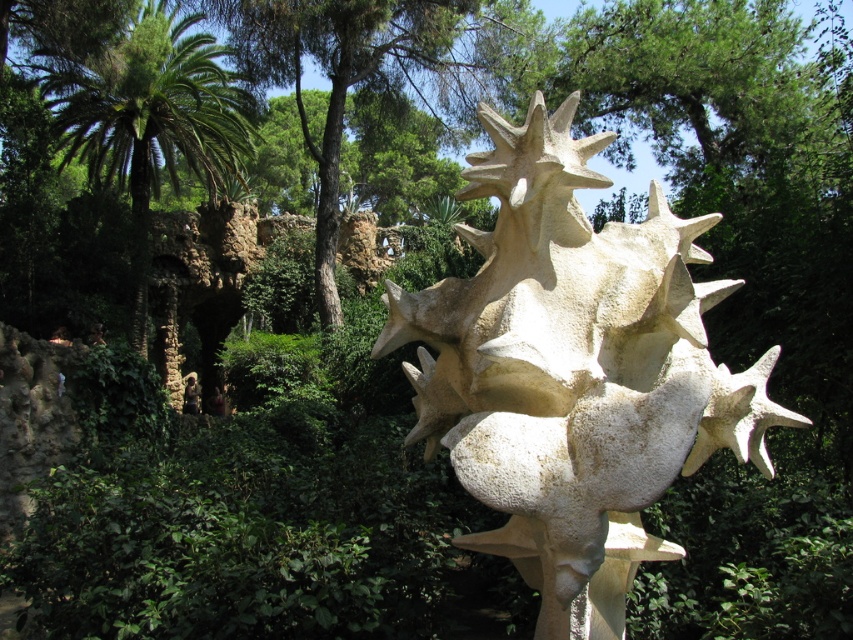
You are a landscape architect designing a walking path that must pass between the white stone sculpture at center and the green leafy tree at upper center. The path needs to be at least 50 feet wide to accommodate visitors. Based on the scene, can the path be constructed as planned?

The distance between the white stone sculpture at center and the green leafy tree at upper center is 54.67 feet, which is greater than the required 50 feet. Therefore, the path can be constructed as planned.

You are standing at the entrance of the sculpture garden and want to locate the white stone sculpture at center. According to the coordinates provided, where should you look relative to your current position?

The white stone sculpture at center is located at coordinates point (573, 371), which means it is positioned slightly to the right and below the center of the garden from your current position at the entrance.